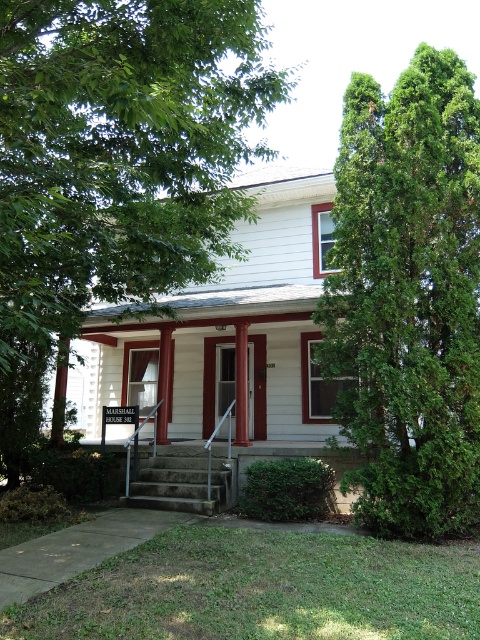
What is the position of the green leafy tree at upper right relative to the smooth wood door at center in the image of the MARSHALL HOUSE?

The green leafy tree at upper right is positioned to the left of the smooth wood door at center.

You are planning to place a new bench on the porch of the MARSHALL HOUSE. The bench is 1.2 meters wide. Considering the green textured evergreen tree at right and the concrete stairs at center, which object should you avoid placing the bench near to ensure it fits?

You should avoid placing the bench near the green textured evergreen tree at right because its width is larger than the concrete stairs at center. Since the bench is 1.2 meters wide, it might not fit near the wider tree area.

You are standing on the sidewalk in front of the MARSHALL HOUSE. You want to take a photo of the house with the green leafy tree at upper right in the background. The camera you are using has a maximum focus distance of 4 meters. Will the camera be able to capture the tree clearly in the photo?

The green leafy tree at upper right and the camera are 3.76 meters apart. Since the camera can focus up to 4 meters, it will be able to capture the tree clearly as the distance is within the maximum focus range.